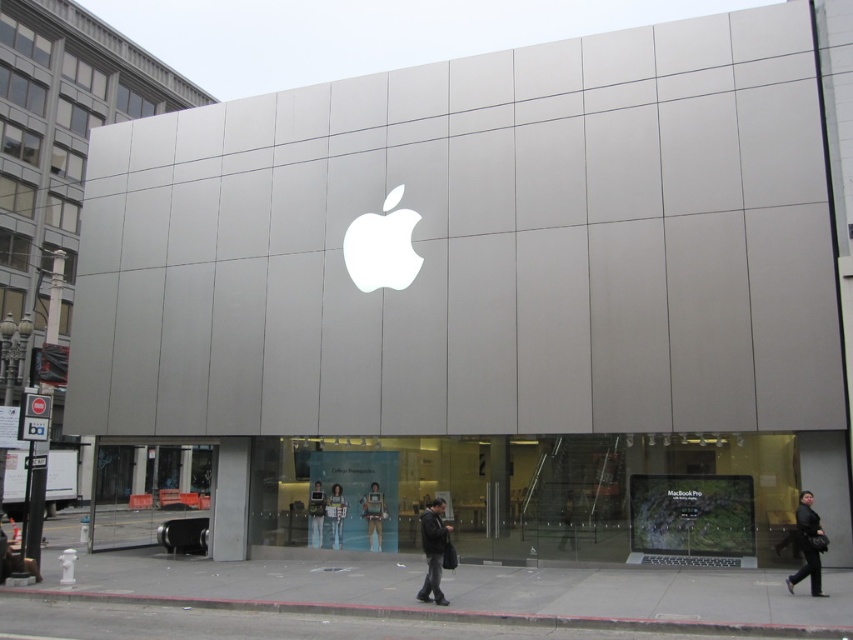
You are standing outside the Apple Store and notice a black leather jacket at lower right. Where exactly is it positioned relative to the Apple logo?

The black leather jacket at lower right is located at point (x=808, y=545), which is to the right and below the Apple logo positioned at the center of the upper portion of the wall.

You are a customer standing outside the Apple Store. You see a dark gray jacket at center and a light blue jeans at center. Which clothing item is higher up on the person?

The dark gray jacket at center is above the light blue jeans at center, so the jacket is higher up on the person.

You are a customer entering the Apple Store and see a mannequin wearing a dark gray jacket at center and light blue jeans at center. Which clothing item is taller on the mannequin?

The dark gray jacket at center is taller than the light blue jeans at center.